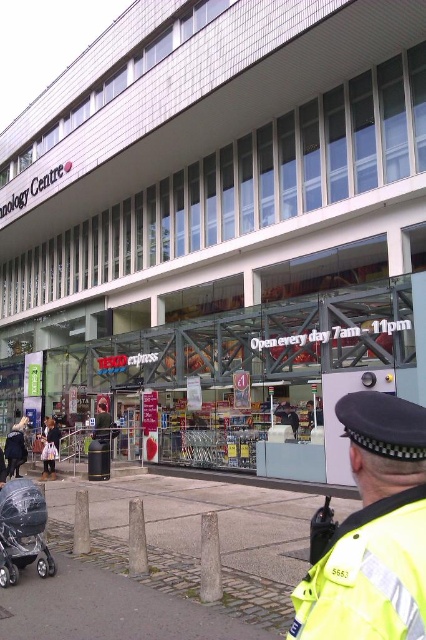
Between point (34, 536) and point (19, 435), which one is positioned in front?

Positioned in front is point (34, 536).

Who is more forward, (0, 490) or (14, 467)?

Point (0, 490)

Identify the location of silver metallic stroller at lower left. (23, 531).

Does silver metallic stroller at lower left appear over dark gray jacket at center?

Yes.

Does silver metallic stroller at lower left appear under dark gray jacket at center?

Incorrect, silver metallic stroller at lower left is not positioned below dark gray jacket at center.

Describe the element at coordinates (23, 531) in the screenshot. This screenshot has width=426, height=640. I see `silver metallic stroller at lower left` at that location.

This screenshot has width=426, height=640. I want to click on silver metallic stroller at lower left, so click(23, 531).

Is dark blue jeans at lower left wider than dark gray jacket at center?

Indeed, dark blue jeans at lower left has a greater width compared to dark gray jacket at center.

Between dark blue jeans at lower left and dark gray jacket at center, which one is positioned lower?

dark blue jeans at lower left is below.

Where is `dark blue jeans at lower left`? dark blue jeans at lower left is located at coordinates (16, 449).